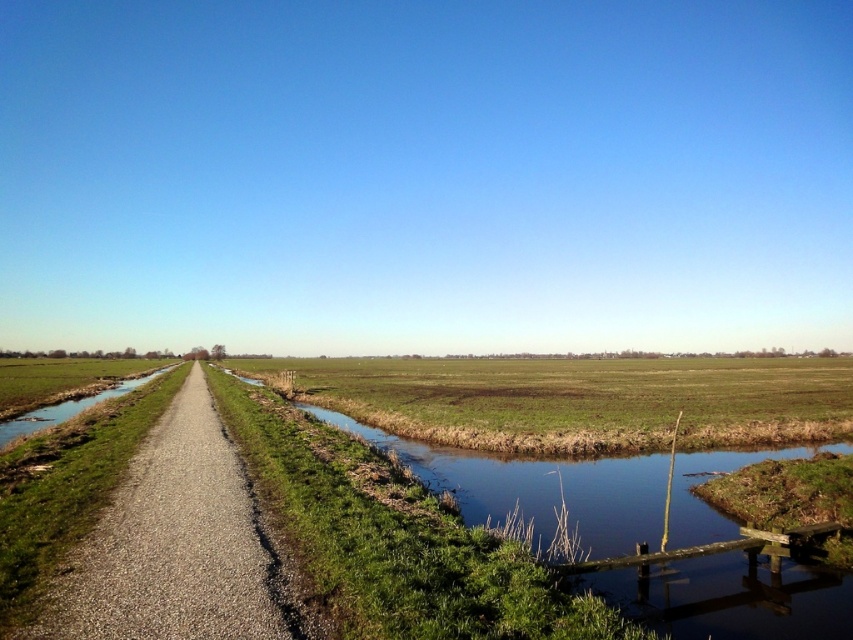
Question: Does green grassy field at center have a greater width compared to green grassy stream at center?

Choices:
 (A) no
 (B) yes

Answer: (B)

Question: Where is green grassy field at center located in relation to green grassy stream at center in the image?

Choices:
 (A) left
 (B) right

Answer: (B)

Question: Is green grassy field at center positioned behind green grassy stream at center?

Choices:
 (A) yes
 (B) no

Answer: (A)

Question: Which is farther from the green grassy field at center?

Choices:
 (A) green grassy stream at center
 (B) gravel road at center

Answer: (B)

Question: Which of these objects is positioned closest to the gravel road at center?

Choices:
 (A) green grassy field at center
 (B) green grassy stream at center

Answer: (B)

Question: Which object is positioned farthest from the gravel road at center?

Choices:
 (A) green grassy stream at center
 (B) green grassy field at center

Answer: (B)